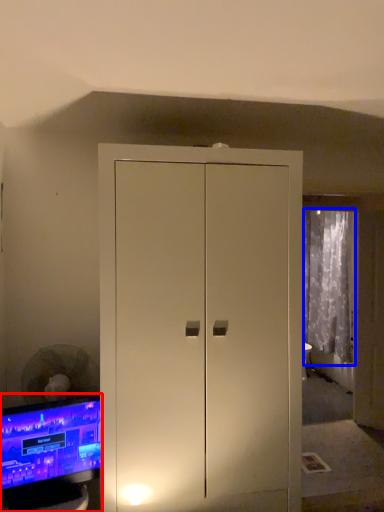
Question: Which object is closer to the camera taking this photo, computer monitor (highlighted by a red box) or curtain (highlighted by a blue box)?

Choices:
 (A) computer monitor
 (B) curtain

Answer: (A)